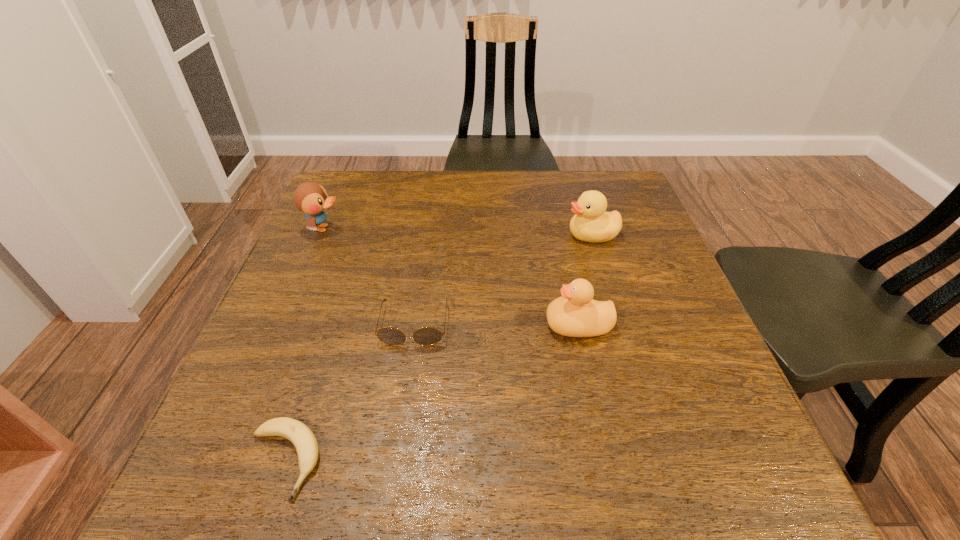
Where is `free space located 0.060m on the lenses of the sunglasses`? free space located 0.060m on the lenses of the sunglasses is located at coordinates (407, 374).

Identify the location of free space located on the right of the nearest object. (461, 460).

Identify the location of object located at the near edge. (303, 439).

Identify the location of duck positioned at the left edge. (311, 198).

This screenshot has height=540, width=960. Identify the location of banana present at the left edge. (303, 439).

Image resolution: width=960 pixels, height=540 pixels. What are the coordinates of `object at the right edge` in the screenshot? It's located at (591, 223).

In order to click on object situated at the near left corner in this screenshot , I will do `click(303, 439)`.

In the image, there is a desktop. At what (x,y) coordinates should I click in order to perform the action: click on free space at the far edge. Please return your answer as a coordinate pair (x, y). Image resolution: width=960 pixels, height=540 pixels. Looking at the image, I should click on tap(394, 199).

In the image, there is a desktop. Find the location of `vacant region at the left edge`. vacant region at the left edge is located at coordinates (257, 357).

Where is `free space at the right edge of the desktop`? free space at the right edge of the desktop is located at coordinates (645, 401).